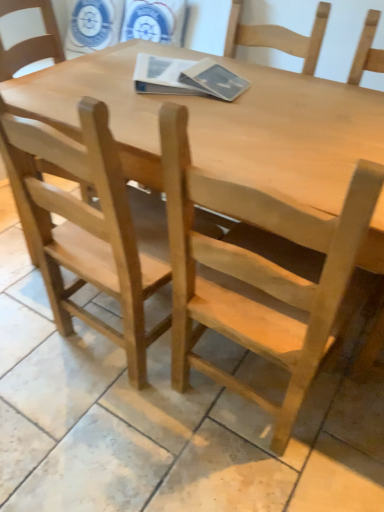
This screenshot has width=384, height=512. Identify the location of free space in front of natural wood chair at left, the 1th chair in the left-to-right sequence. (99, 432).